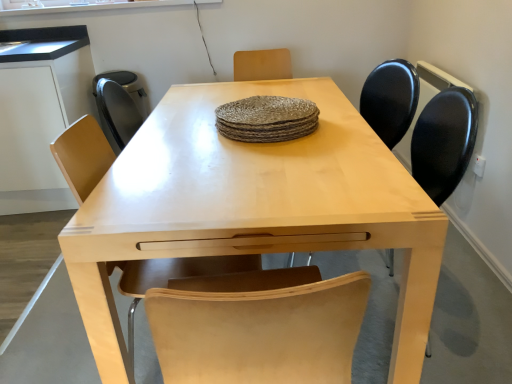
Locate an element on the screen. The width and height of the screenshot is (512, 384). vacant space situated above light wood table at center (from a real-world perspective) is located at coordinates (241, 145).